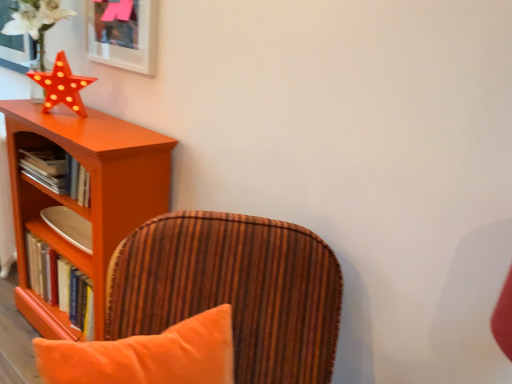
Question: Does orange wood shelf at left have a lesser width compared to hardcover books at left, the first book when ordered from top to bottom?

Choices:
 (A) yes
 (B) no

Answer: (B)

Question: From the image's perspective, does orange wood shelf at left appear lower than hardcover books at left, which appears as the second book when ordered from the bottom?

Choices:
 (A) no
 (B) yes

Answer: (B)

Question: Considering the relative sizes of orange wood shelf at left and hardcover books at left, which appears as the second book when ordered from the bottom, in the image provided, is orange wood shelf at left taller than hardcover books at left, which appears as the second book when ordered from the bottom,?

Choices:
 (A) yes
 (B) no

Answer: (A)

Question: Is hardcover books at left, the first book when ordered from top to bottom, inside orange wood shelf at left?

Choices:
 (A) no
 (B) yes

Answer: (B)

Question: Are orange wood shelf at left and hardcover books at left, which appears as the second book when ordered from the bottom, beside each other?

Choices:
 (A) yes
 (B) no

Answer: (B)

Question: In the image, is matte orange star at upper left on the left side or the right side of matte white picture frame at upper left?

Choices:
 (A) right
 (B) left

Answer: (B)

Question: Considering their positions, is matte orange star at upper left located in front of or behind matte white picture frame at upper left?

Choices:
 (A) front
 (B) behind

Answer: (B)

Question: In terms of height, does matte orange star at upper left look taller or shorter compared to matte white picture frame at upper left?

Choices:
 (A) short
 (B) tall

Answer: (A)

Question: From the image's perspective, relative to matte white picture frame at upper left, is matte orange star at upper left above or below?

Choices:
 (A) below
 (B) above

Answer: (A)

Question: Based on their sizes in the image, would you say orange wood shelf at left is bigger or smaller than velvet orange chair at center?

Choices:
 (A) big
 (B) small

Answer: (A)

Question: Looking at their shapes, would you say orange wood shelf at left is wider or thinner than velvet orange chair at center?

Choices:
 (A) wide
 (B) thin

Answer: (B)

Question: Based on their positions, is orange wood shelf at left located to the left or right of velvet orange chair at center?

Choices:
 (A) right
 (B) left

Answer: (B)

Question: Is orange wood shelf at left taller or shorter than velvet orange chair at center?

Choices:
 (A) short
 (B) tall

Answer: (B)

Question: From the image's perspective, is matte white picture frame at upper left located above or below orange wood shelf at left?

Choices:
 (A) below
 (B) above

Answer: (B)

Question: Considering the positions of matte white picture frame at upper left and orange wood shelf at left in the image, is matte white picture frame at upper left taller or shorter than orange wood shelf at left?

Choices:
 (A) short
 (B) tall

Answer: (A)